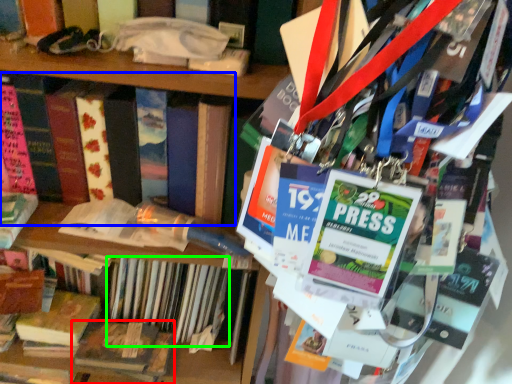
Question: Which is nearer to the book (highlighted by a red box)? book (highlighted by a blue box) or book (highlighted by a green box).

Choices:
 (A) book
 (B) book

Answer: (B)